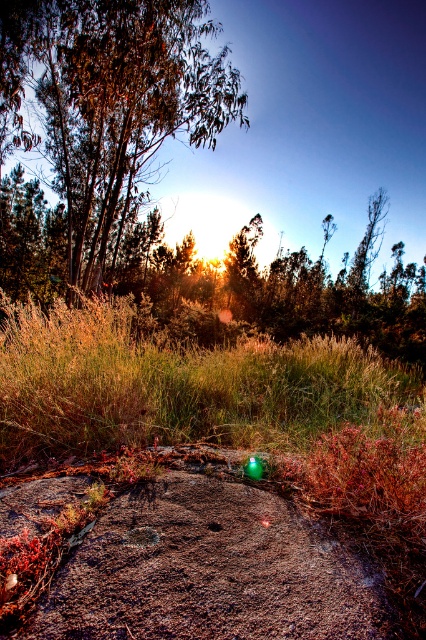
Based on the photo, you are an artist trying to capture this scene. You want to paint the green leafy tree at upper left and the golden grass at center. Which object should you paint first if you follow the rule of painting objects that are higher in the scene first?

The green leafy tree at upper left should be painted first because it is positioned above the golden grass at center.

You are standing at the point closer to the camera between the two points, point (x=78, y=131) and point (x=94, y=374). Which point are you standing at?

You are standing at point (x=78, y=131) because it is further to the camera than point (x=94, y=374).

You are a hiker trying to determine the best path to take. You see a green leafy tree at upper left and golden grass at center. Which object is wider?

The green leafy tree at upper left is wider than the golden grass at center.